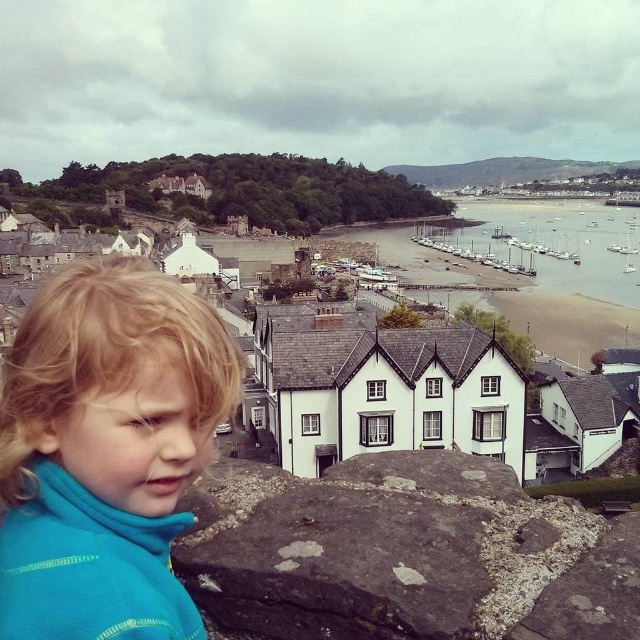
Question: Can you confirm if gray rough stone at lower left is wider than white stone houses at center?

Choices:
 (A) no
 (B) yes

Answer: (A)

Question: Which point appears closest to the camera in this image?

Choices:
 (A) (12, 602)
 (B) (632, 236)
 (C) (192, 499)
 (D) (592, 248)

Answer: (A)

Question: Which point appears farthest from the camera in this image?

Choices:
 (A) (502, 250)
 (B) (276, 358)
 (C) (371, 512)
 (D) (38, 545)

Answer: (A)

Question: Can you confirm if gray rough stone at lower left is wider than blue fleece jacket at lower left?

Choices:
 (A) no
 (B) yes

Answer: (B)

Question: Which point is closer to the camera?

Choices:
 (A) (445, 636)
 (B) (576, 275)

Answer: (A)

Question: Where is white stone houses at center located in relation to smooth water at lower right in the image?

Choices:
 (A) above
 (B) below

Answer: (B)